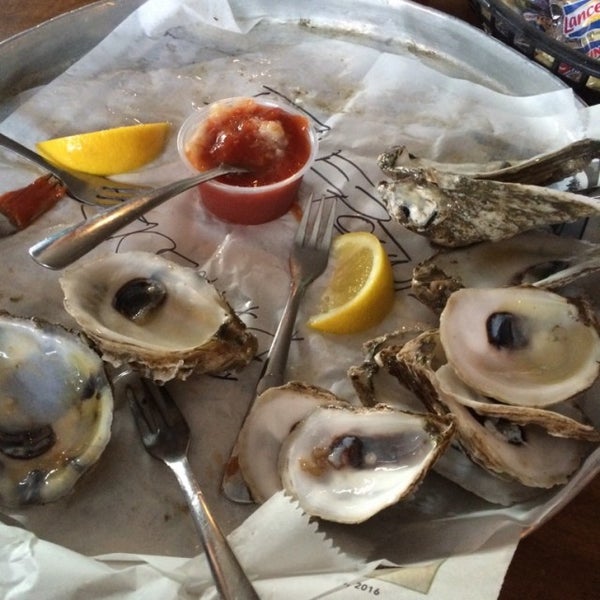
Identify the location of plastic basket. (536, 41).